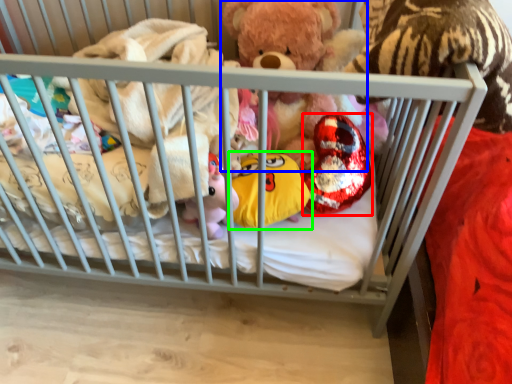
Question: Estimate the real-world distances between objects in this image. Which object is farther from toy (highlighted by a red box), teddy bear (highlighted by a blue box) or toy (highlighted by a green box)?

Choices:
 (A) teddy bear
 (B) toy

Answer: (A)